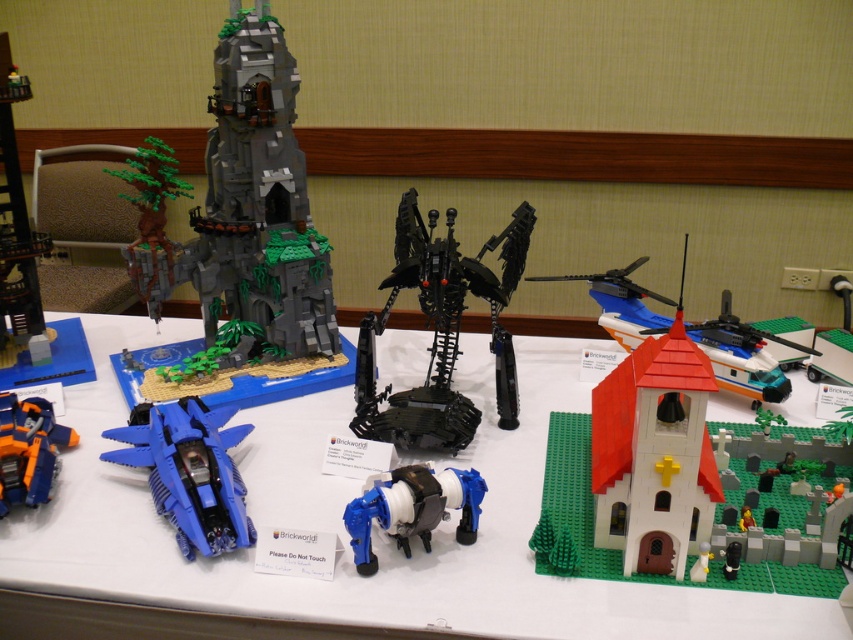
Question: Can you confirm if dark gray stone tower at upper left is positioned below matte blue plastic fighter jet at lower left?

Choices:
 (A) yes
 (B) no

Answer: (B)

Question: Is white plastic table at center bigger than matte blue plastic fighter jet at lower left?

Choices:
 (A) yes
 (B) no

Answer: (A)

Question: Which of the following is the farthest from the observer?

Choices:
 (A) black metallic robot at center
 (B) dark gray stone tower at upper left
 (C) orange and blue plastic transformer robot at lower left
 (D) white matte church at center-right

Answer: (B)

Question: Which point is closer to the camera taking this photo?

Choices:
 (A) (10, 394)
 (B) (468, 529)

Answer: (B)

Question: Which of the following is the closest to the observer?

Choices:
 (A) dark gray stone tower at upper left
 (B) white plastic table at center

Answer: (B)

Question: Is white plastic table at center wider than blue plastic robot at center?

Choices:
 (A) yes
 (B) no

Answer: (A)